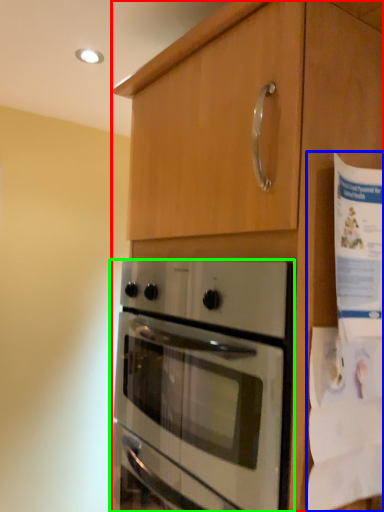
Question: Which object is positioned farthest from cabinetry (highlighted by a red box)? Select from paper (highlighted by a blue box) and oven (highlighted by a green box).

Choices:
 (A) paper
 (B) oven

Answer: (B)